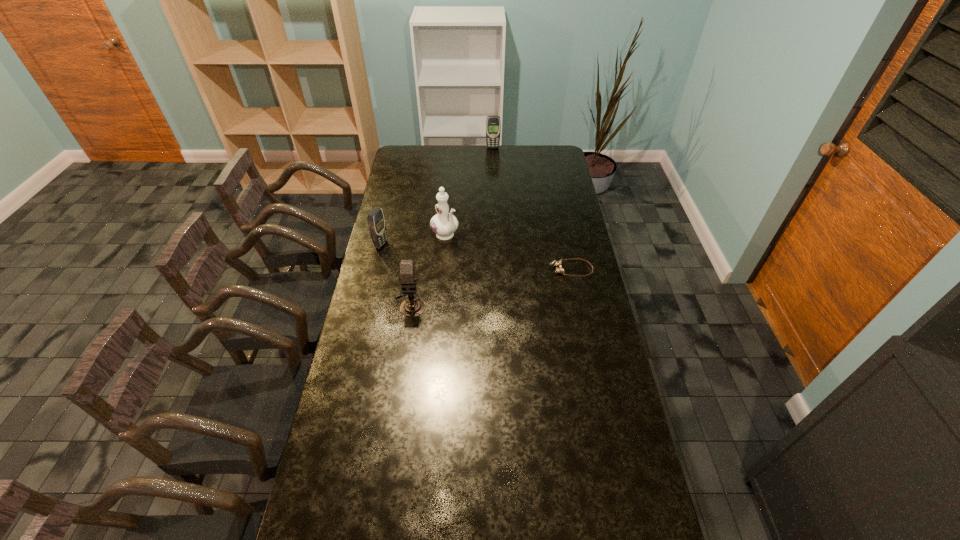
You are a GUI agent. You are given a task and a screenshot of the screen. Output one action in this format:
    pyautogui.click(x=<x>, y=<y>)
    Task: Click on the nearest object
    
    Given the screenshot: What is the action you would take?
    pyautogui.click(x=411, y=307)

I want to click on goggles, so click(x=557, y=264).

Find the location of a particular element. the rightmost object is located at coordinates (557, 264).

Locate an element on the screen. The image size is (960, 540). chinaware is located at coordinates (444, 224).

Identify the location of the farther cellular telephone. Image resolution: width=960 pixels, height=540 pixels. (493, 125).

Locate an element on the screen. This screenshot has height=540, width=960. the fourth object from left to right is located at coordinates (493, 125).

Where is `the leftmost object`? The height and width of the screenshot is (540, 960). the leftmost object is located at coordinates (376, 222).

This screenshot has height=540, width=960. In order to click on the nearer cellular telephone in this screenshot , I will do `click(376, 222)`.

This screenshot has width=960, height=540. Find the location of `vacant area situated on the front-facing side of the microphone`. vacant area situated on the front-facing side of the microphone is located at coordinates (396, 405).

This screenshot has width=960, height=540. I want to click on free space located on the front lenses and sides of the rightmost object, so click(482, 269).